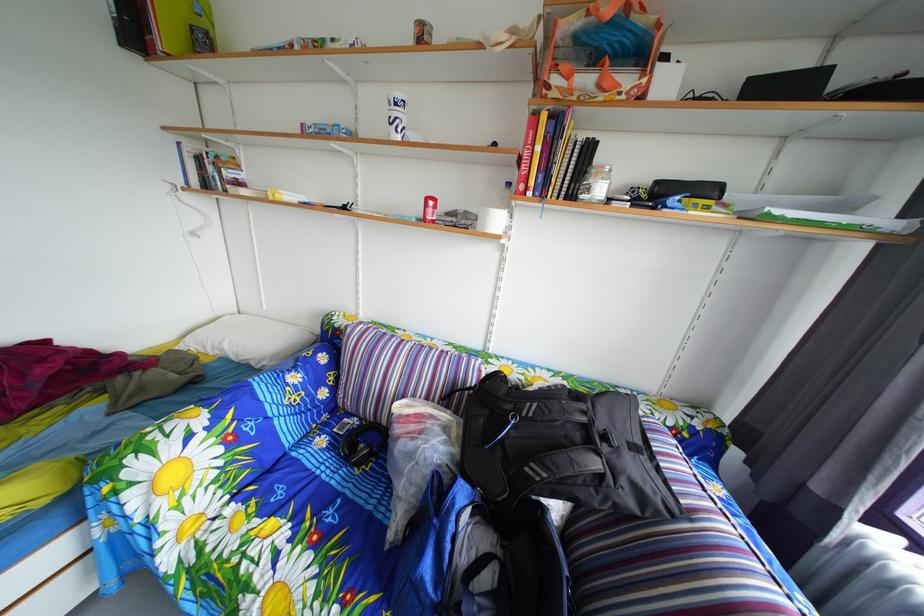
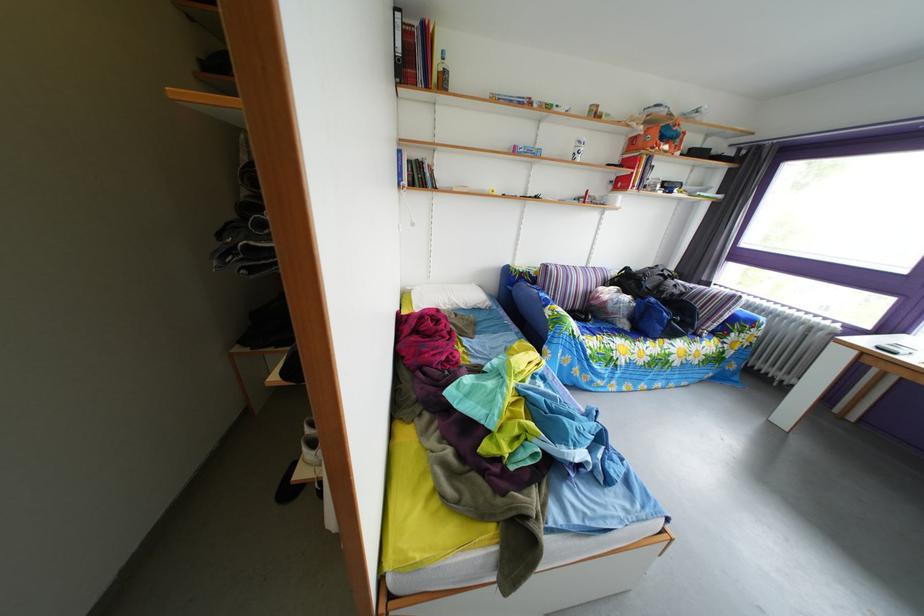
Question: I am providing you with two images of the same scene from different viewpoints. After the viewpoint changes to image2, which objects are now occluded?

Choices:
 (A) blue zipper pull
 (B) blue bag
 (C) blue sofa armrest
 (D) gray headphones

Answer: (A)